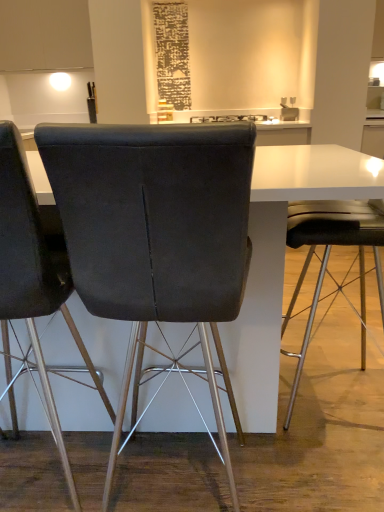
Question: Is point (64, 228) closer or farther from the camera than point (279, 103)?

Choices:
 (A) closer
 (B) farther

Answer: (A)

Question: From a real-world perspective, is dark gray fabric chair at center, which is the 2th chair in right-to-left order, physically located above or below matte white sink at upper center?

Choices:
 (A) above
 (B) below

Answer: (B)

Question: Which of these objects is positioned farthest from the black glossy toaster at center?

Choices:
 (A) matte black chair at right, positioned as the third chair in left-to-right order
 (B) matte white sink at upper center
 (C) velvet dark gray chair at left, the first chair positioned from the left
 (D) dark gray fabric chair at center, which is the 2th chair in right-to-left order

Answer: (D)

Question: Which is farther from the black glossy toaster at center?

Choices:
 (A) velvet dark gray chair at left, acting as the 3th chair starting from the right
 (B) matte white sink at upper center
 (C) dark gray fabric chair at center, which is the 2th chair in right-to-left order
 (D) matte black chair at right, the 1th chair positioned from the right

Answer: (C)